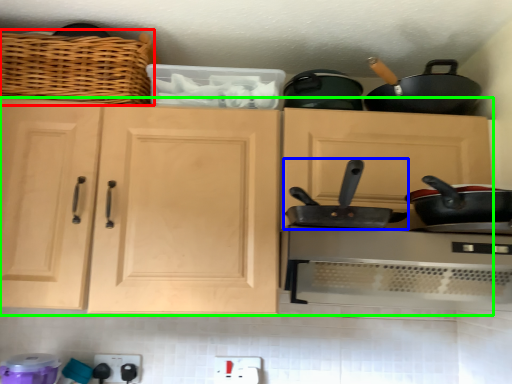
Question: Which is farther away from basket (highlighted by a red box)? frying pan (highlighted by a blue box) or cabinetry (highlighted by a green box)?

Choices:
 (A) frying pan
 (B) cabinetry

Answer: (A)